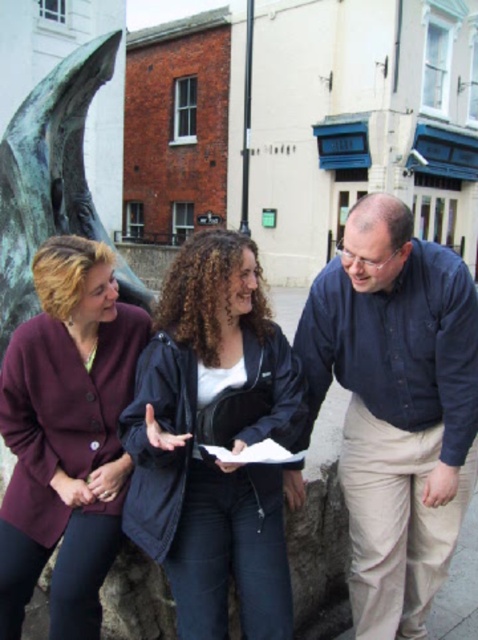
Which is below, matte purple cardigan at center left or dark blue jacket at center?

matte purple cardigan at center left

Who is higher up, matte purple cardigan at center left or dark blue jacket at center?

dark blue jacket at center is above.

Does point (89, 602) come in front of point (100, 595)?

Yes, point (89, 602) is closer to viewer.

I want to click on matte purple cardigan at center left, so click(66, 435).

Can you confirm if blue button-down shirt at center is positioned below black matte jacket at center?

Yes.

Who is lower down, blue button-down shirt at center or black matte jacket at center?

Positioned lower is blue button-down shirt at center.

Locate an element on the screen. blue button-down shirt at center is located at coordinates (395, 406).

Which of these two, blue button-down shirt at center or dark blue jacket at center, stands taller?

dark blue jacket at center

Looking at this image, is blue button-down shirt at center behind dark blue jacket at center?

No, it is not.

The height and width of the screenshot is (640, 478). Identify the location of blue button-down shirt at center. (395, 406).